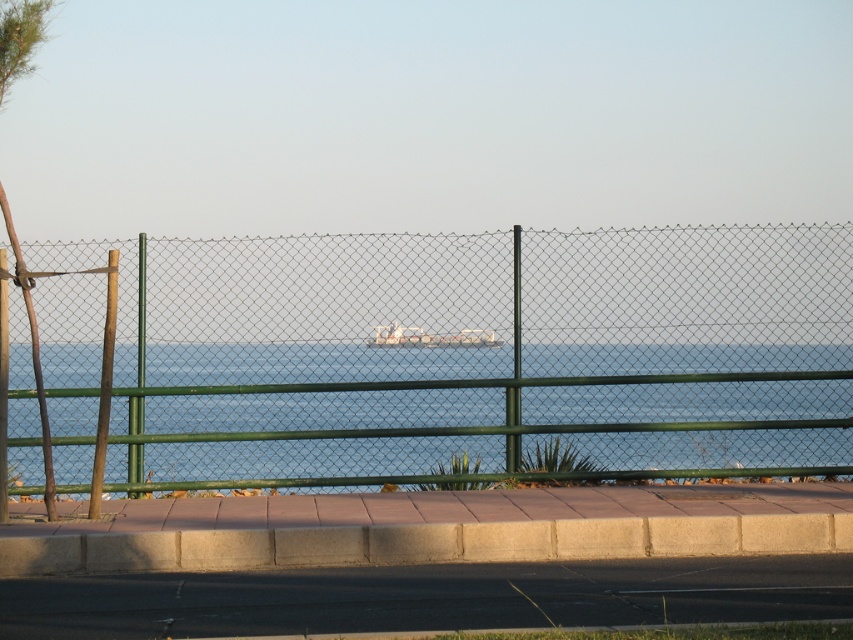
Image resolution: width=853 pixels, height=640 pixels. Describe the element at coordinates (424, 544) in the screenshot. I see `smooth concrete curb at lower center` at that location.

Image resolution: width=853 pixels, height=640 pixels. I want to click on smooth concrete curb at lower center, so click(424, 544).

Where is `smooth concrete curb at lower center`? The image size is (853, 640). smooth concrete curb at lower center is located at coordinates (424, 544).

Image resolution: width=853 pixels, height=640 pixels. Identify the location of smooth concrete curb at lower center. (424, 544).

How far apart are smooth concrete curb at lower center and green leafy palm tree at left?

smooth concrete curb at lower center is 6.50 feet away from green leafy palm tree at left.

Who is shorter, smooth concrete curb at lower center or green leafy palm tree at left?

smooth concrete curb at lower center is shorter.

Does point (630, 516) come farther from viewer compared to point (28, 8)?

That is False.

Locate an element on the screen. The height and width of the screenshot is (640, 853). smooth concrete curb at lower center is located at coordinates (424, 544).

Is green chain-link fence at center above gray concrete pavement at lower center?

Correct, green chain-link fence at center is located above gray concrete pavement at lower center.

Is green chain-link fence at center further to camera compared to gray concrete pavement at lower center?

Yes, it is behind gray concrete pavement at lower center.

This screenshot has height=640, width=853. I want to click on green chain-link fence at center, so click(x=488, y=349).

Locate an element on the screen. green chain-link fence at center is located at coordinates (488, 349).